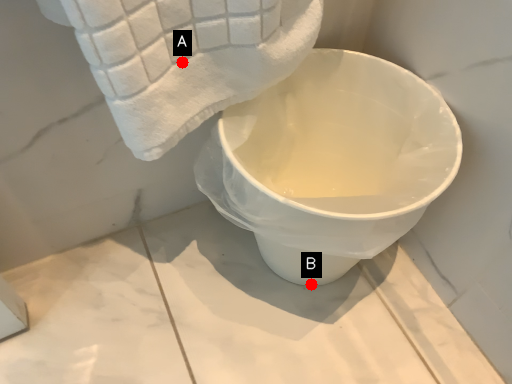
Question: Two points are circled on the image, labeled by A and B beside each circle. Which point is closer to the camera?

Choices:
 (A) A is closer
 (B) B is closer

Answer: (A)